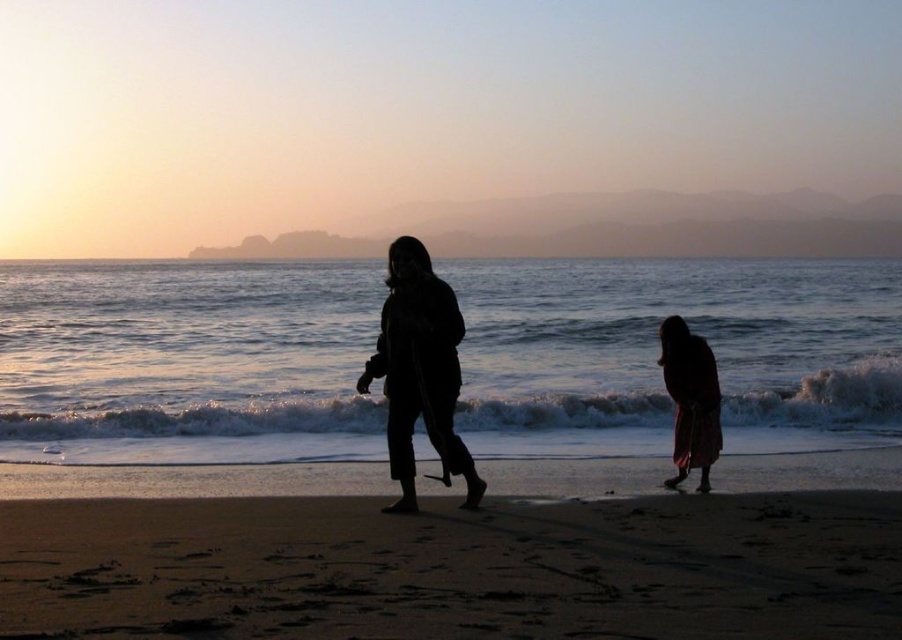
You are standing on the beach and want to pick up the silhouette coat at center. Which direction should you move to reach it first, considering the dark sand at lower center is between you and the coat?

The dark sand at lower center is closer to you than the silhouette coat at center, so you should move forward towards the silhouette coat at center past the dark sand at lower center to reach it.

You are a photographer trying to capture the two figures in the beach scene. The silhouette coat at center and the silhouette fabric at lower right are both in your frame. Which object should you focus on if you want to photograph the larger one?

The silhouette coat at center is bigger than the silhouette fabric at lower right, so you should focus on the silhouette coat at center to photograph the larger one.

You are standing on the beach and see two objects in the distance. One is the silhouette coat at center and the other is the silhouette fabric at lower right. Which object is nearer to you?

The silhouette coat at center is closer to the viewer than the silhouette fabric at lower right.